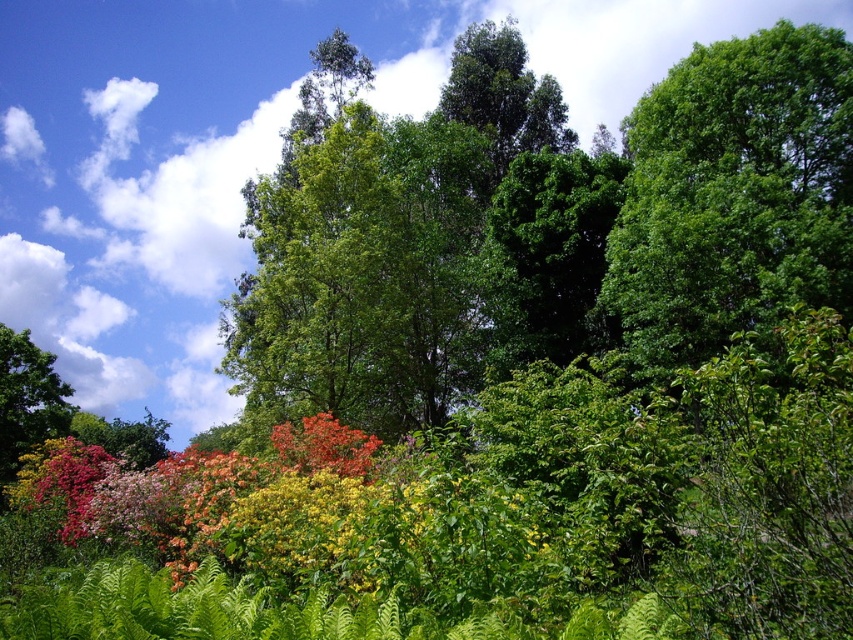
Which of these two, green leafy tree at upper right or vivid orange leaves at center, stands shorter?

vivid orange leaves at center is shorter.

Which of these two, green leafy tree at upper right or vivid orange leaves at center, stands taller?

Standing taller between the two is green leafy tree at upper right.

Where is `green leafy tree at upper right`? green leafy tree at upper right is located at coordinates (733, 195).

Is point (822, 182) positioned behind point (351, 477)?

Yes, point (822, 182) is behind point (351, 477).

Is green leafy tree at upper right positioned at the back of multicolored foliage at center?

That is True.

Who is more distant from viewer, [836,172] or [97,468]?

Point [836,172]

Where is `green leafy tree at upper right`? The height and width of the screenshot is (640, 853). green leafy tree at upper right is located at coordinates pyautogui.click(x=733, y=195).

Does multicolored foliage at center appear under vivid orange leaves at center?

Yes.

Which is more to the right, multicolored foliage at center or vivid orange leaves at center?

Positioned to the right is vivid orange leaves at center.

Find the location of a particular element. Image resolution: width=853 pixels, height=640 pixels. multicolored foliage at center is located at coordinates (286, 516).

Where is `multicolored foliage at center`? The image size is (853, 640). multicolored foliage at center is located at coordinates (286, 516).